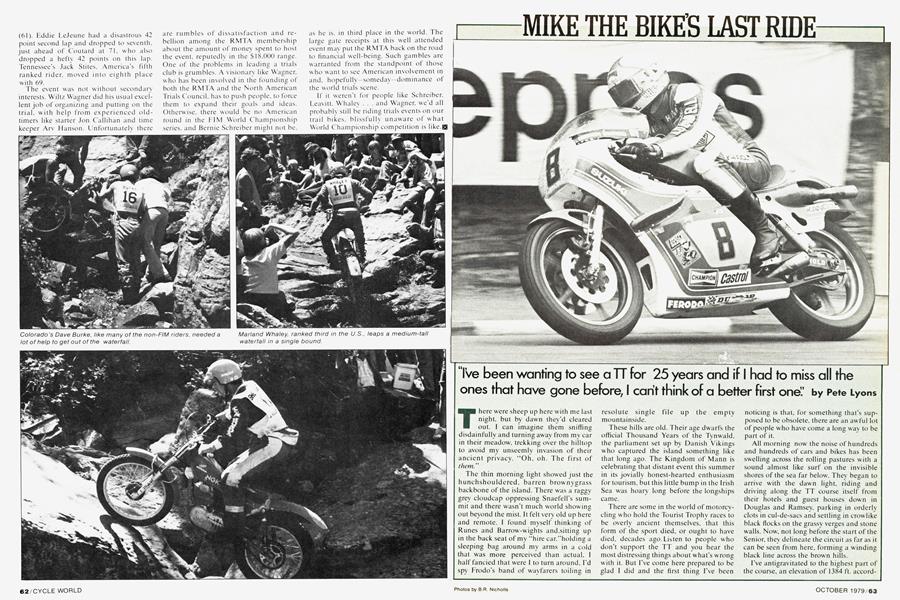
I want to click on 4 black and white pictures, so click(95, 270), click(311, 212), click(208, 447), click(680, 160).